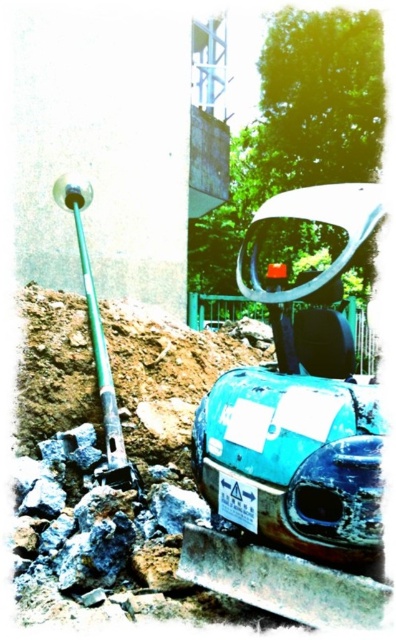
Question: Which point appears farthest from the camera in this image?

Choices:
 (A) (319, 410)
 (B) (62, 182)
 (C) (270, 353)

Answer: (C)

Question: Which point appears farthest from the camera in this image?

Choices:
 (A) (297, 371)
 (B) (159, 326)
 (C) (57, 204)

Answer: (C)

Question: Does teal matte car at center appear on the left side of green metallic shovel at upper left?

Choices:
 (A) no
 (B) yes

Answer: (A)

Question: Can you confirm if brown soil at lower left is bigger than green metallic shovel at upper left?

Choices:
 (A) yes
 (B) no

Answer: (A)

Question: Estimate the real-world distances between objects in this image. Which object is farther from the green metallic shovel at upper left?

Choices:
 (A) teal matte car at center
 (B) brown soil at lower left

Answer: (A)

Question: Does teal matte car at center have a larger size compared to green metallic shovel at upper left?

Choices:
 (A) yes
 (B) no

Answer: (B)